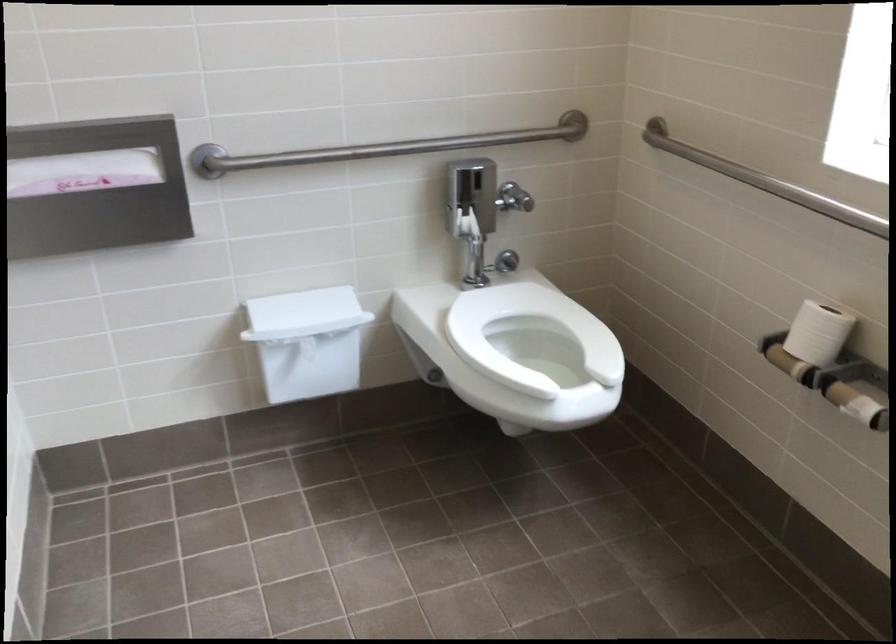
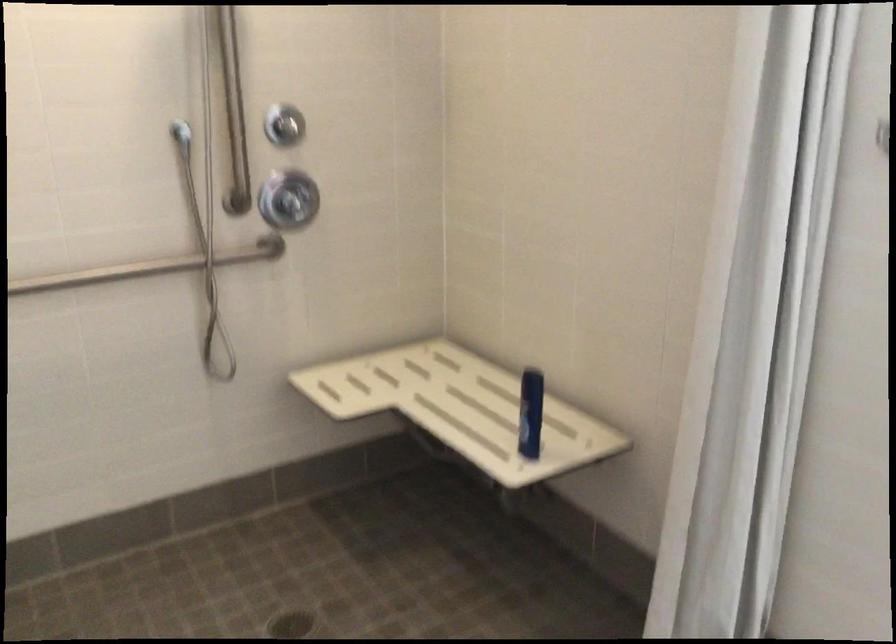
Question: I am providing you with two images of the same scene from different viewpoints. After the viewpoint changes to image2, which objects are now occluded?

Choices:
 (A) toilet seat cover
 (B) metal pot side handle
 (C) chair sitting surface
 (D) chrome shower knob

Answer: (A)